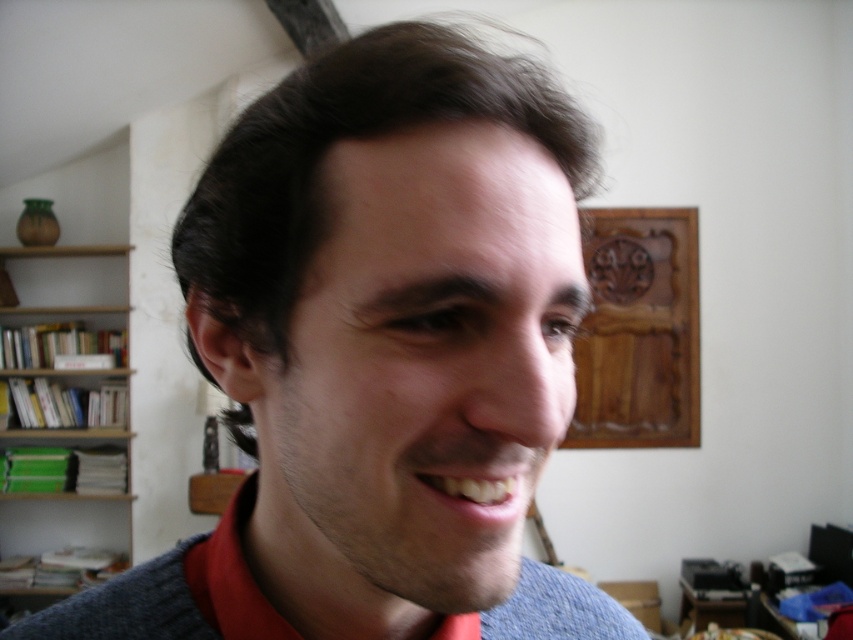
You are helping to organize a closet and need to place the gray wool sweater at center and the wooden shelves at left. Given their sizes, which object should be placed on top of the other?

The gray wool sweater at center is not as tall as the wooden shelves at left, so the sweater can be placed on top of the shelves.

You are a fashion designer analyzing the placement of a pin on a model wearing a gray wool sweater. The pin is placed at point (379, 355). Based on the image, where exactly is the pin located on the gray wool sweater at center?

The pin is located at point (379, 355) on the gray wool sweater at center.

You are taking a photo of the scene and want to focus on both the point at coordinates point (631, 627) and point (67, 252). Given their positions, which point should you adjust your focus to prioritize first to ensure both are in clear view?

Point (631, 627) is closer to the camera than point (67, 252), so you should prioritize focusing on point (631, 627) first to ensure both points are in clear view.